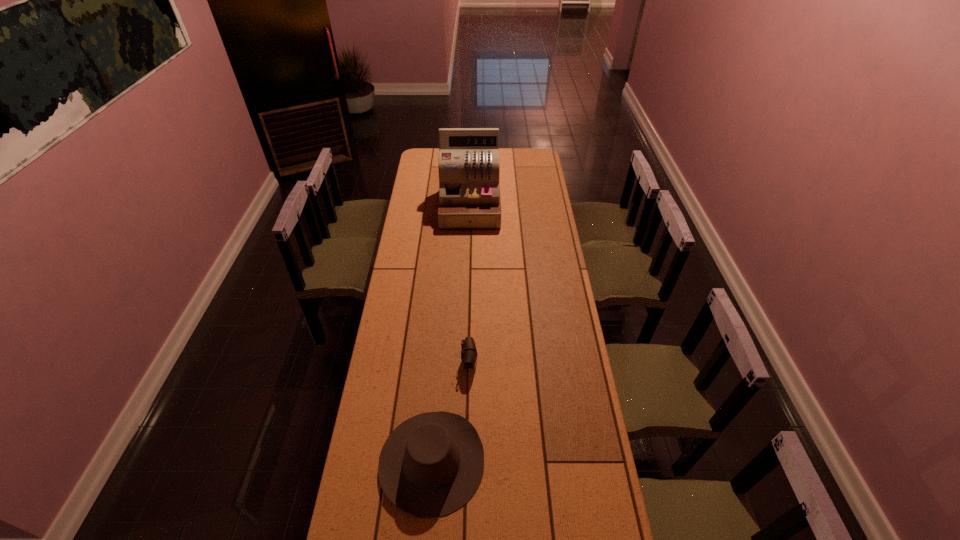
You are a GUI agent. You are given a task and a screenshot of the screen. Output one action in this format:
    pyautogui.click(x=<x>, y=<y>)
    Task: Click on the farthest object
    Image resolution: width=960 pixels, height=540 pixels.
    Given the screenshot: What is the action you would take?
    pyautogui.click(x=469, y=193)

Find the location of `cash register`. cash register is located at coordinates (469, 193).

The height and width of the screenshot is (540, 960). In order to click on cowboy hat in this screenshot , I will do `click(431, 465)`.

This screenshot has width=960, height=540. In order to click on the nearest object in this screenshot , I will do tap(431, 465).

You are a GUI agent. You are given a task and a screenshot of the screen. Output one action in this format:
    pyautogui.click(x=<x>, y=<y>)
    Task: Click on the shortest object
    
    Given the screenshot: What is the action you would take?
    pyautogui.click(x=469, y=354)

Identify the location of pouch. The width and height of the screenshot is (960, 540). (469, 354).

Where is `vacant space positioned 0.400m on the operating side of the tallest object`? Image resolution: width=960 pixels, height=540 pixels. vacant space positioned 0.400m on the operating side of the tallest object is located at coordinates (468, 286).

Where is `vacant region located on the right of the cowboy hat`? This screenshot has width=960, height=540. vacant region located on the right of the cowboy hat is located at coordinates (527, 461).

The image size is (960, 540). I want to click on free spot located with the flap open on the shortest object, so [x=547, y=362].

The height and width of the screenshot is (540, 960). In order to click on object situated at the left edge in this screenshot , I will do `click(431, 465)`.